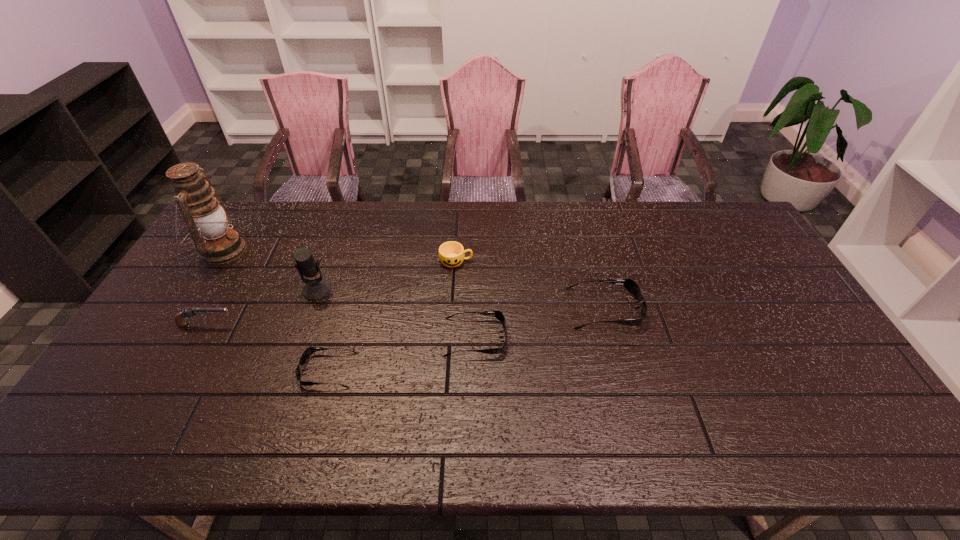
In the current image, all sunglassess are evenly spaced. To maintain this equal spacing, where should an additional sunglasses be placed on the right? Please point out a free spot. Please provide its 2D coordinates. Your answer should be formatted as a tuple, i.e. [(x, y)], where the tuple contains the x and y coordinates of a point satisfying the conditions above.

[(721, 282)]